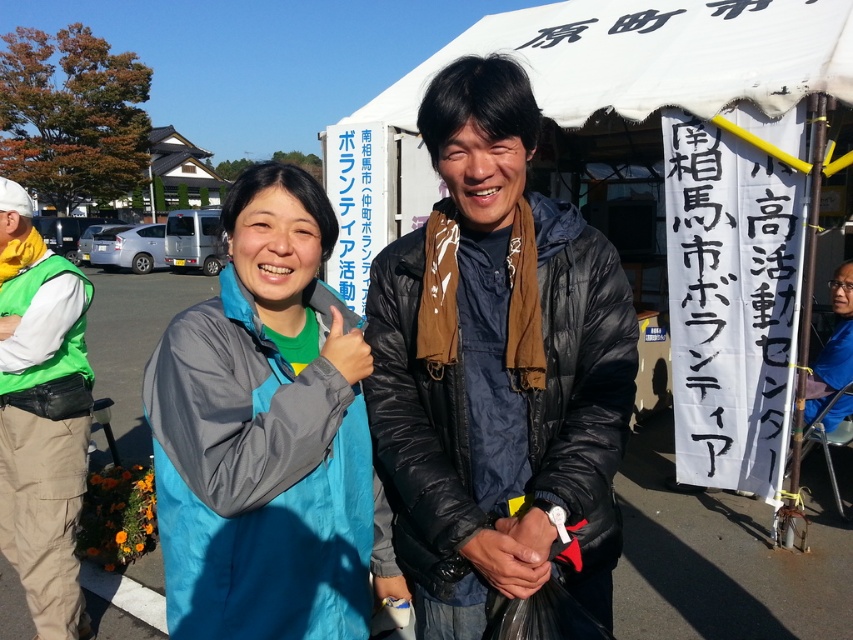
Question: Which object is positioned farthest from the white fabric canopy at upper center?

Choices:
 (A) black puffy jacket at center
 (B) white fabric tent at upper center

Answer: (A)

Question: Does black puffy jacket at center lie behind dark blue jacket at center?

Choices:
 (A) yes
 (B) no

Answer: (B)

Question: Which of the following is the farthest from the observer?

Choices:
 (A) click(x=556, y=312)
 (B) click(x=496, y=42)
 (C) click(x=846, y=413)
 (D) click(x=77, y=572)

Answer: (B)

Question: Does black puffy jacket at center have a larger size compared to white fabric tent at upper center?

Choices:
 (A) yes
 (B) no

Answer: (B)

Question: Among these points, which one is farthest from the camera?

Choices:
 (A) (595, 604)
 (B) (560, 19)
 (C) (305, 356)

Answer: (B)

Question: Can you confirm if black puffy jacket at center is positioned below white fabric canopy at upper center?

Choices:
 (A) yes
 (B) no

Answer: (A)